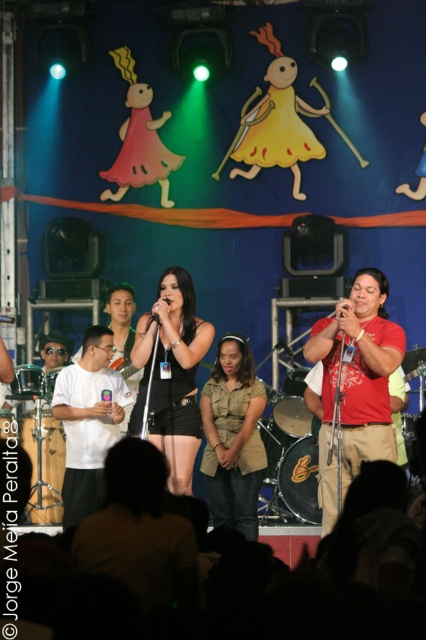
Question: Does black plastic microphone at center come behind black matte microphone at center?

Choices:
 (A) yes
 (B) no

Answer: (B)

Question: Which point is farther to the camera?

Choices:
 (A) black matte dress at center
 (B) red cotton shirt at center
 (C) black matte microphone at center
 (D) matte black dress at center

Answer: (D)

Question: Which object is the farthest from the black matte dress at center?

Choices:
 (A) white matte t-shirt at center
 (B) black matte microphone at center
 (C) matte black dress at center

Answer: (C)

Question: Which point appears closest to the camera in this image?

Choices:
 (A) (344, 310)
 (B) (152, 314)

Answer: (A)

Question: Does khaki cotton shirt at center have a smaller size compared to white matte t-shirt at center?

Choices:
 (A) no
 (B) yes

Answer: (B)

Question: Does red cotton shirt at center appear over black matte dress at center?

Choices:
 (A) yes
 (B) no

Answer: (B)